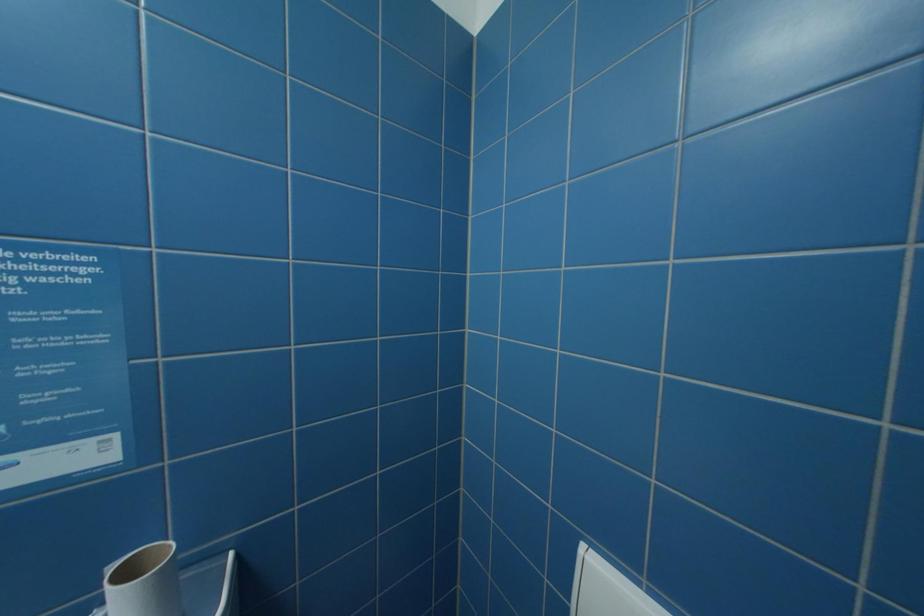
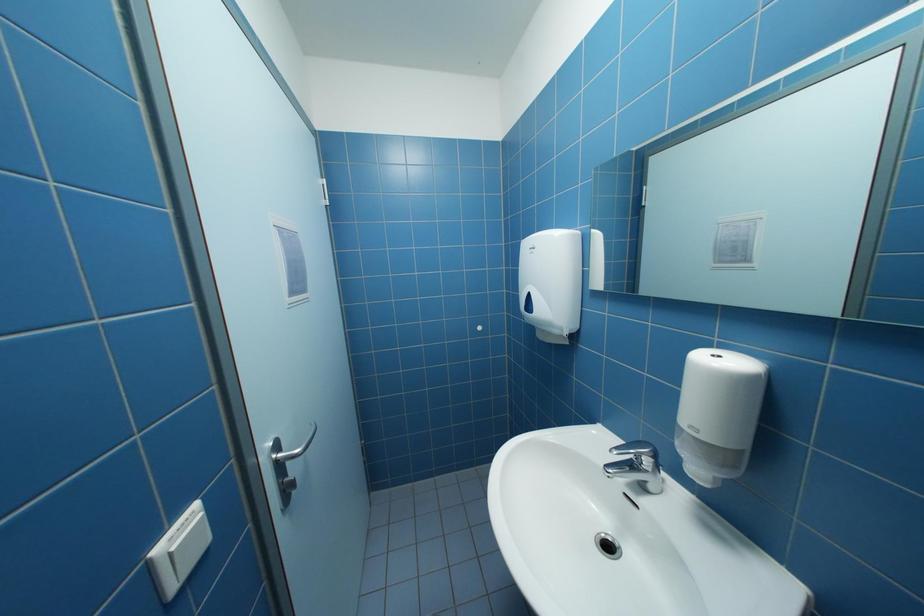
Question: How did the camera likely rotate?

Choices:
 (A) Left
 (B) Right
 (C) Up
 (D) Down

Answer: (A)